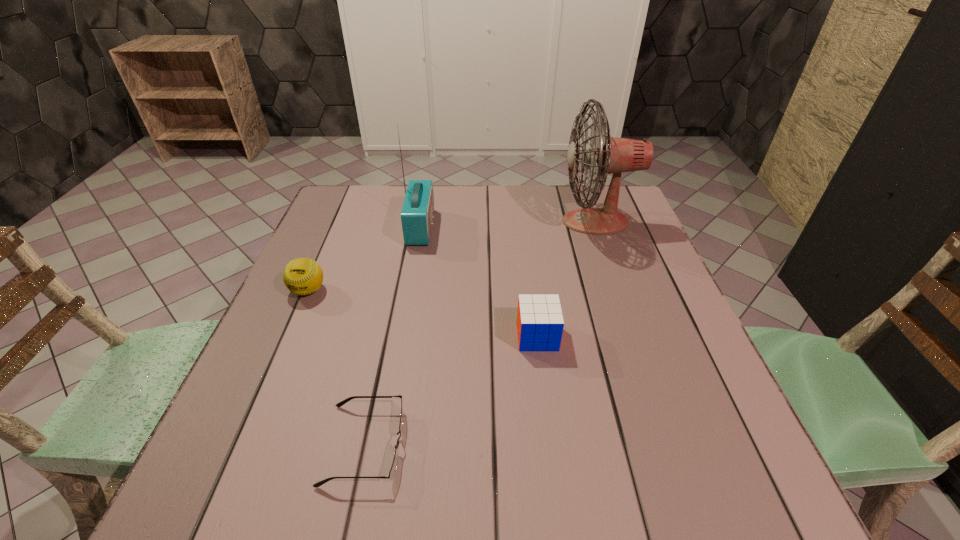
Where is `the tallest object`? the tallest object is located at coordinates (604, 155).

Find the location of `fan`. fan is located at coordinates (604, 155).

Find the location of a particular element. This screenshot has height=540, width=960. the fourth shortest object is located at coordinates (417, 214).

Locate an element on the screen. The image size is (960, 540). the leftmost object is located at coordinates (303, 276).

I want to click on softball, so click(x=303, y=276).

Where is `cube`? cube is located at coordinates (540, 323).

Locate an element on the screen. the second nearest object is located at coordinates point(540,323).

Where is `spectacles`? This screenshot has width=960, height=540. spectacles is located at coordinates (393, 469).

Locate an element on the screen. The width and height of the screenshot is (960, 540). the nearest object is located at coordinates (393, 469).

Find the location of `vacant space situated 0.180m in front of the fan to direct airflow`. vacant space situated 0.180m in front of the fan to direct airflow is located at coordinates (496, 221).